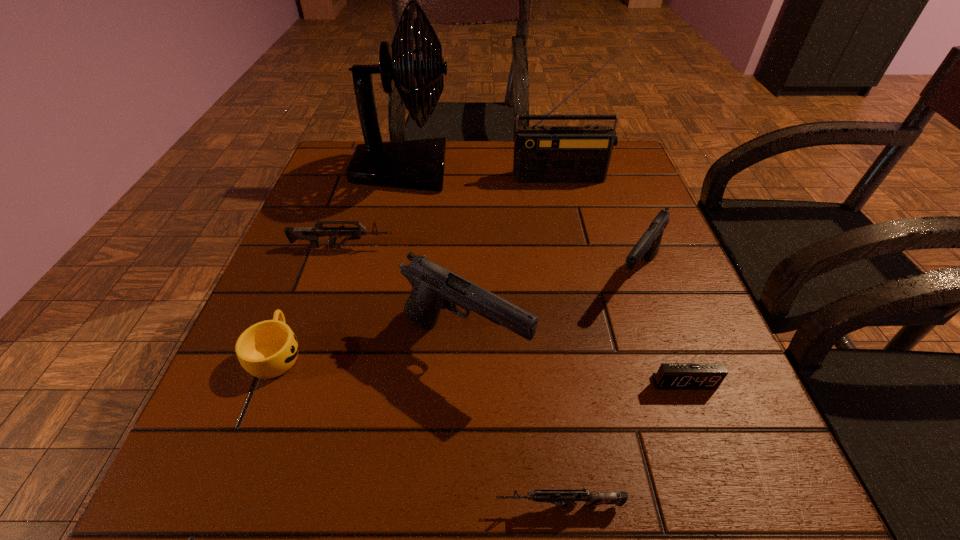
The width and height of the screenshot is (960, 540). What are the coordinates of `fan` in the screenshot? It's located at [x=416, y=164].

This screenshot has height=540, width=960. I want to click on radio receiver, so click(542, 154).

Locate an element on the screen. The height and width of the screenshot is (540, 960). the left black gun is located at coordinates (434, 287).

Where is `the sixth shortest object`? The height and width of the screenshot is (540, 960). the sixth shortest object is located at coordinates (434, 287).

Where is `the rightmost gun`? The height and width of the screenshot is (540, 960). the rightmost gun is located at coordinates (648, 245).

Where is `the third shortest gun`? the third shortest gun is located at coordinates (648, 245).

Where is `the third tallest gun`? The image size is (960, 540). the third tallest gun is located at coordinates 312,234.

The image size is (960, 540). In order to click on the farther grey gun in this screenshot , I will do `click(312, 234)`.

The height and width of the screenshot is (540, 960). Find the location of `cup`. cup is located at coordinates click(267, 349).

Where is `alarm clock`? This screenshot has height=540, width=960. alarm clock is located at coordinates (670, 376).